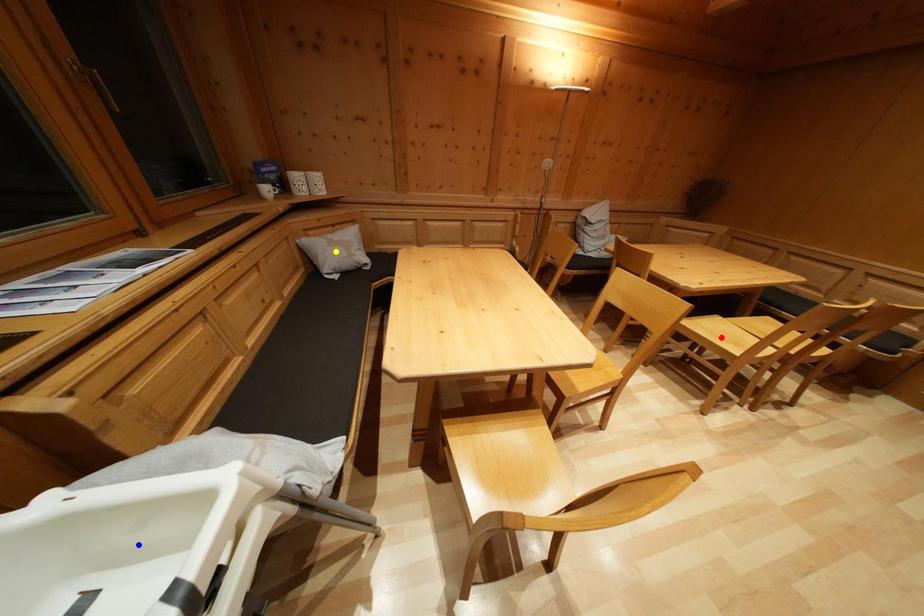
Order these from nearest to farthest:
- blue point
- yellow point
- red point

blue point
red point
yellow point